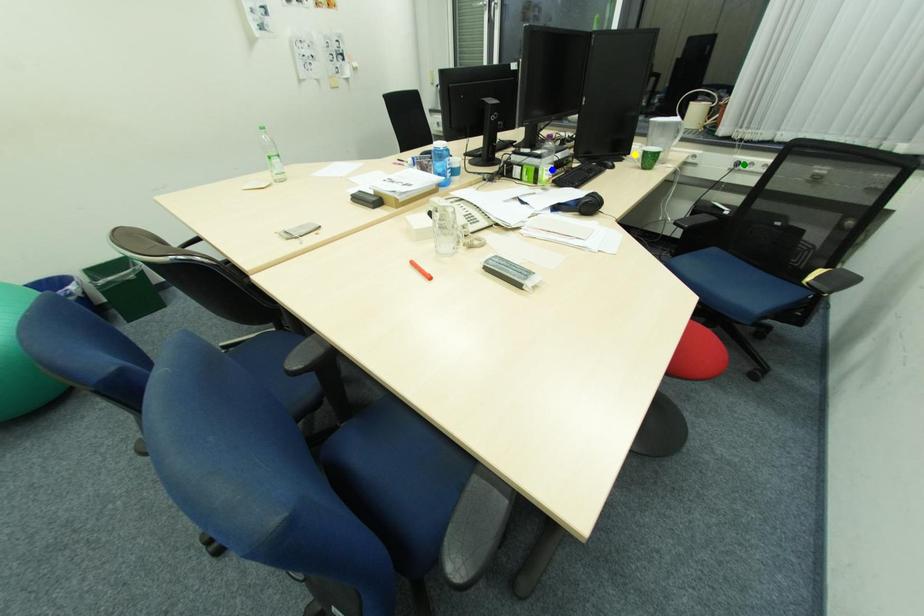
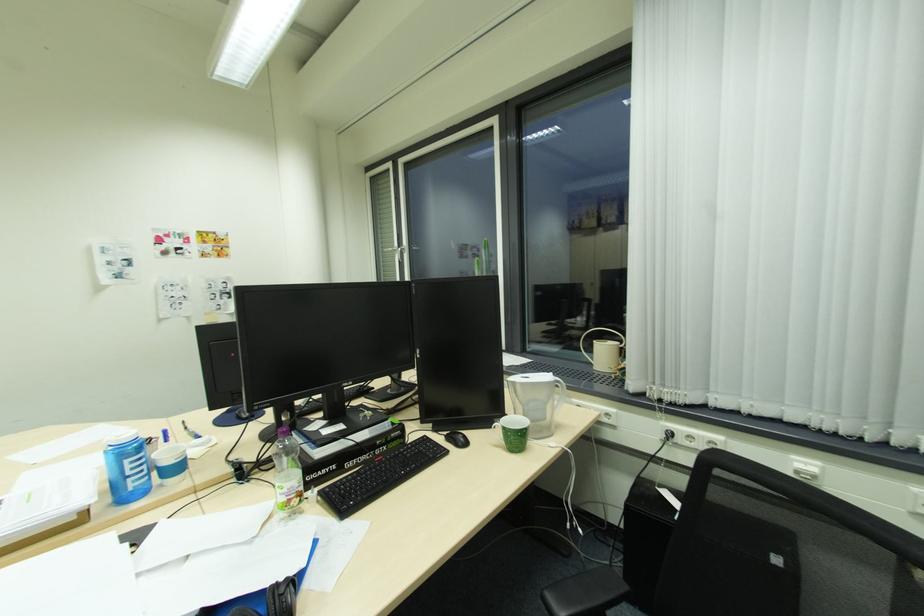
I am providing you with two images of the same scene from different viewpoints. Three points are marked in image1. Which point corresponds to a part or object that is occluded in image2?In image1, three points are marked. Which of them correspond to a part or object that is occluded in image2?Among the three points shown in image1, which one corresponds to a part or object that is no longer visible due to occlusion in image2?

yellow point cannot be seen in image2.